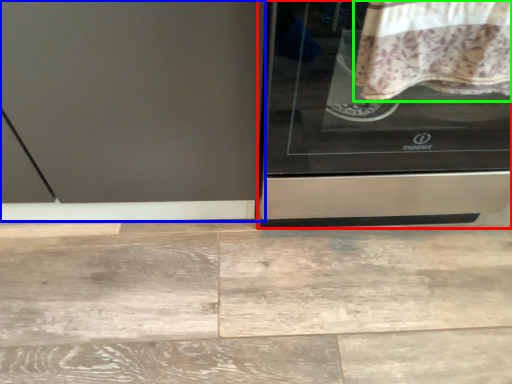
Question: Which object is the farthest from home appliance (highlighted by a red box)? Choose among these: screen door (highlighted by a blue box) or blanket (highlighted by a green box).

Choices:
 (A) screen door
 (B) blanket

Answer: (A)